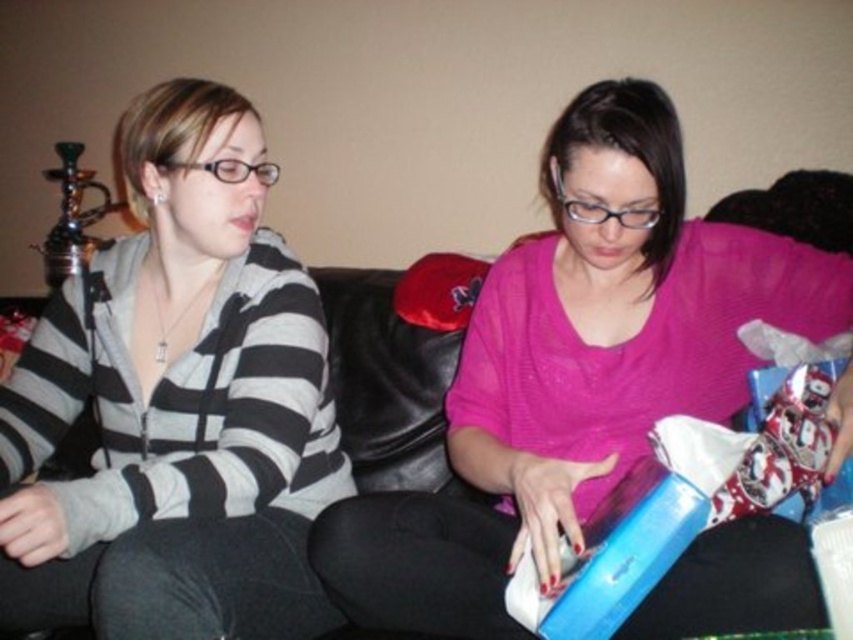
You are taking a photo of the two people on the black leather couch. You want to focus on the person closer to the camera. Which point should you focus on, point [142,140] or point [520,541]?

Point [142,140] is further to the camera than point [520,541], so you should focus on point [142,140] to capture the person closer to the camera.

You are designing a new interior layout and need to ensure that the matte gray hoodie at left and the black leather couch at center fit within a 10x10 meter room. Given their sizes, can both items comfortably fit in the room without overcrowding?

The matte gray hoodie at left is larger in size than the black leather couch at center. Since the room is 10x10 meters, both items can comfortably fit without overcrowding as their combined size is likely manageable within the space.

You are a photographer setting up a shoot in this scene. You want to ensure the pink sheer sweater at center is visible without being blocked by the black leather couch at center. Based on the scene description, is this arrangement possible?

Yes, the pink sheer sweater at center is in front of the black leather couch at center, so it is not blocked and remains visible.